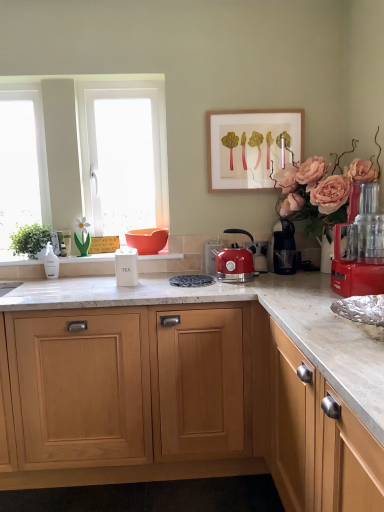
Find the location of a particular element. free space in front of white matte tea container at center, which ranks as the third kitchen appliance in back-to-front order is located at coordinates (119, 292).